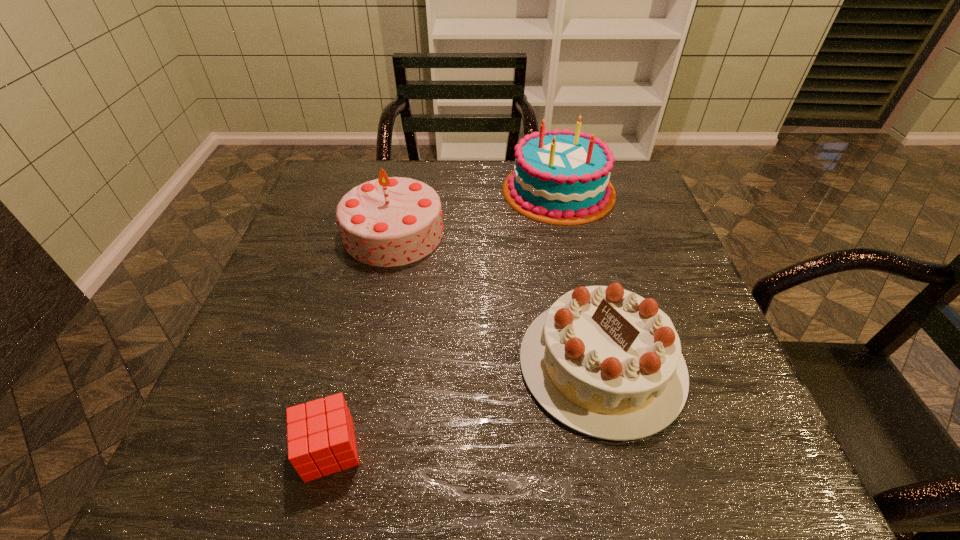
Locate an element on the screen. This screenshot has height=540, width=960. the leftmost birthday cake is located at coordinates (391, 221).

What are the coordinates of `the shortest birthday cake` in the screenshot? It's located at (606, 362).

At what (x,y) coordinates should I click in order to perform the action: click on the nearest birthday cake. Please return your answer as a coordinate pair (x, y). The height and width of the screenshot is (540, 960). Looking at the image, I should click on (606, 362).

The height and width of the screenshot is (540, 960). In order to click on cube in this screenshot , I will do `click(321, 441)`.

The image size is (960, 540). Find the location of `vacant region located on the front of the leftmost birthday cake`. vacant region located on the front of the leftmost birthday cake is located at coordinates (373, 328).

Image resolution: width=960 pixels, height=540 pixels. In order to click on blank space located 0.170m on the back of the shortest birthday cake in this screenshot , I will do `click(575, 251)`.

At what (x,y) coordinates should I click in order to perform the action: click on vacant space situated on the back of the shortest object. Please return your answer as a coordinate pair (x, y). Looking at the image, I should click on (371, 283).

The width and height of the screenshot is (960, 540). What are the coordinates of `birthday cake that is at the near edge` in the screenshot? It's located at pyautogui.click(x=606, y=362).

The width and height of the screenshot is (960, 540). Identify the location of cube located at the near edge. (321, 441).

Where is `object located at the left edge`? object located at the left edge is located at coordinates (391, 221).